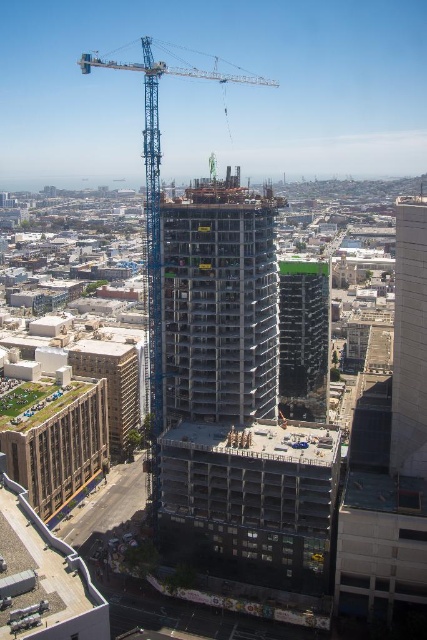
Question: Can you confirm if white concrete building at right is bigger than black glass building at center?

Choices:
 (A) yes
 (B) no

Answer: (A)

Question: Which of these objects is positioned farthest from the concrete building at center?

Choices:
 (A) black glass building at center
 (B) blue metallic crane at center
 (C) concrete construction site at center

Answer: (B)

Question: Can you confirm if concrete building at center is bigger than black glass building at center?

Choices:
 (A) no
 (B) yes

Answer: (B)

Question: Which object is the farthest from the blue metallic crane at center?

Choices:
 (A) concrete building at center
 (B) concrete construction site at center
 (C) black glass building at center

Answer: (C)

Question: Estimate the real-world distances between objects in this image. Which object is farther from the concrete construction site at center?

Choices:
 (A) concrete building at center
 (B) white concrete building at right
 (C) black glass building at center

Answer: (C)

Question: Is concrete building at center bigger than black glass building at center?

Choices:
 (A) no
 (B) yes

Answer: (B)